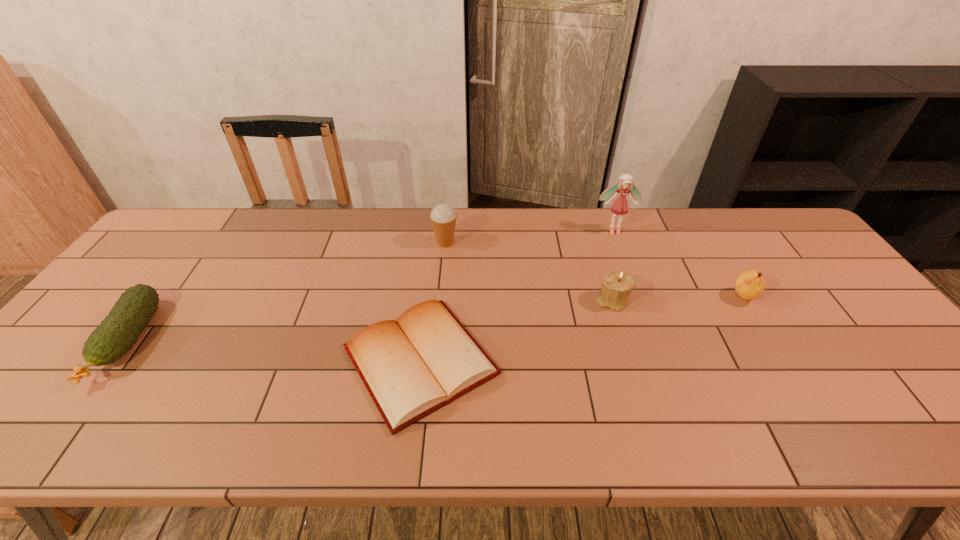
What are the coordinates of `free space that is in between the Bible and the second shortest object` in the screenshot? It's located at (274, 350).

Image resolution: width=960 pixels, height=540 pixels. What are the coordinates of `empty location between the candle_holder and the doll` in the screenshot? It's located at (612, 266).

Locate an element on the screen. The height and width of the screenshot is (540, 960). vacant space that's between the tallest object and the rightmost object is located at coordinates (679, 264).

The height and width of the screenshot is (540, 960). What are the coordinates of `the fourth closest object relative to the Bible` in the screenshot? It's located at (118, 332).

Point out which object is positioned as the fourth nearest to the Bible. Please provide its 2D coordinates. Your answer should be formatted as a tuple, i.e. [(x, y)], where the tuple contains the x and y coordinates of a point satisfying the conditions above.

[(118, 332)]

At what (x,y) coordinates should I click in order to perform the action: click on vacant position in the image that satisfies the following two spatial constraints: 1. at the blossom end of the shortest object; 2. on the right side of the fifth tallest object. Please return your answer as a coordinate pair (x, y). This screenshot has height=540, width=960. Looking at the image, I should click on (112, 361).

Locate an element on the screen. This screenshot has height=540, width=960. free space in the image that satisfies the following two spatial constraints: 1. at the blossom end of the Bible; 2. on the right side of the second shortest object is located at coordinates (112, 361).